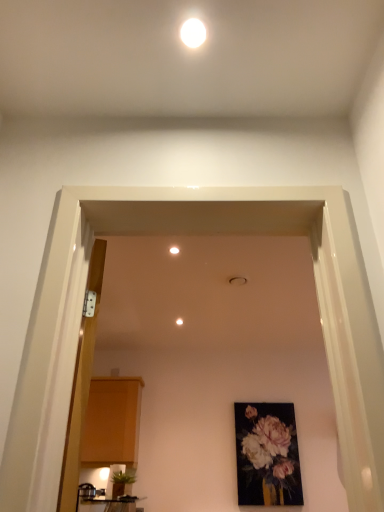
Question: Which direction should I rotate to face white matte ceiling light at center, which ranks as the second lighting in top-to-bottom order, — up or down?

Choices:
 (A) up
 (B) down

Answer: (A)

Question: From a real-world perspective, is white glossy light fixture at upper center, which ranks as the 1th lighting in top-to-bottom order, over green leafy plant at lower left?

Choices:
 (A) no
 (B) yes

Answer: (B)

Question: Can you confirm if white glossy light fixture at upper center, which ranks as the 1th lighting in top-to-bottom order, is positioned to the right of green leafy plant at lower left?

Choices:
 (A) yes
 (B) no

Answer: (A)

Question: Is white glossy light fixture at upper center, which ranks as the 2th lighting in bottom-to-top order, at the left side of green leafy plant at lower left?

Choices:
 (A) yes
 (B) no

Answer: (B)

Question: From a real-world perspective, is white glossy light fixture at upper center, which ranks as the second lighting in left-to-right order, under green leafy plant at lower left?

Choices:
 (A) yes
 (B) no

Answer: (B)

Question: Is white glossy light fixture at upper center, which ranks as the second lighting in left-to-right order, in contact with green leafy plant at lower left?

Choices:
 (A) no
 (B) yes

Answer: (A)

Question: Is the depth of white glossy light fixture at upper center, which ranks as the 2th lighting in bottom-to-top order, less than that of green leafy plant at lower left?

Choices:
 (A) yes
 (B) no

Answer: (A)

Question: Is white matte ceiling light at center, marked as the 1th lighting in a bottom-to-top arrangement, thinner than matte wood cabinet at left?

Choices:
 (A) no
 (B) yes

Answer: (B)

Question: Could you tell me if white matte ceiling light at center, the first lighting positioned from the left, is facing matte wood cabinet at left?

Choices:
 (A) yes
 (B) no

Answer: (B)

Question: Is white matte ceiling light at center, marked as the 1th lighting in a bottom-to-top arrangement, completely or partially outside of matte wood cabinet at left?

Choices:
 (A) no
 (B) yes

Answer: (B)

Question: Is the depth of white matte ceiling light at center, marked as the 1th lighting in a bottom-to-top arrangement, less than that of matte wood cabinet at left?

Choices:
 (A) no
 (B) yes

Answer: (B)

Question: Is matte wood cabinet at left located within white matte ceiling light at center, marked as the 1th lighting in a bottom-to-top arrangement?

Choices:
 (A) no
 (B) yes

Answer: (A)

Question: Is white matte ceiling light at center, the first lighting positioned from the left, facing away from matte wood cabinet at left?

Choices:
 (A) no
 (B) yes

Answer: (A)

Question: Is green leafy plant at lower left completely or partially inside matte black table at lower left?

Choices:
 (A) yes
 (B) no

Answer: (B)